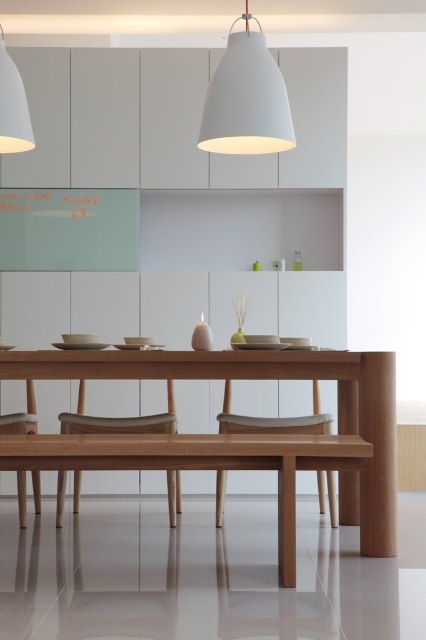
Question: Does natural wood table at center have a greater width compared to light brown wooden chair at lower left?

Choices:
 (A) yes
 (B) no

Answer: (A)

Question: Is natural wood table at center wider than light brown wooden chair at center?

Choices:
 (A) yes
 (B) no

Answer: (A)

Question: Which of the following is the closest to the observer?

Choices:
 (A) matte white pendant lamp at upper center
 (B) light brown wooden chair at center
 (C) light brown wood chair at center

Answer: (A)

Question: Which object is the farthest from the light brown wooden chair at center?

Choices:
 (A) natural wood table at center
 (B) light brown wooden chair at lower left
 (C) white matte pendant light at upper center
 (D) matte white pendant lamp at upper center

Answer: (D)

Question: Can you confirm if natural wood table at center is positioned below light brown wooden chair at lower left?

Choices:
 (A) no
 (B) yes

Answer: (A)

Question: Among these points, which one is nearest to the camera?

Choices:
 (A) (173, 496)
 (B) (16, 100)
 (C) (25, 481)

Answer: (B)